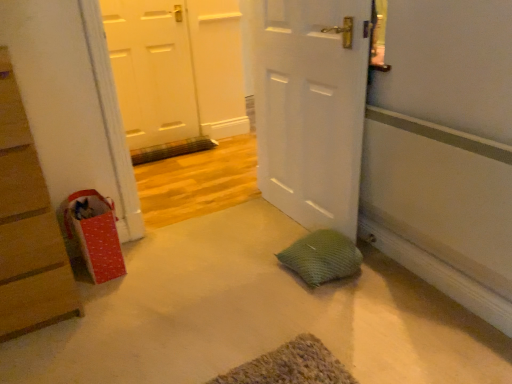
Question: From a real-world perspective, is white matte door at upper left, the first door from the left, physically above green mesh pillow at center?

Choices:
 (A) no
 (B) yes

Answer: (B)

Question: Can you confirm if white matte door at upper left, which is counted as the second door, starting from the right, is taller than green mesh pillow at center?

Choices:
 (A) no
 (B) yes

Answer: (B)

Question: Are white matte door at upper left, acting as the first door starting from the back, and green mesh pillow at center making contact?

Choices:
 (A) no
 (B) yes

Answer: (A)

Question: Can you confirm if white matte door at upper left, the second door viewed from the front, is thinner than green mesh pillow at center?

Choices:
 (A) no
 (B) yes

Answer: (B)

Question: Could you tell me if white matte door at upper left, the first door from the left, is turned towards green mesh pillow at center?

Choices:
 (A) no
 (B) yes

Answer: (B)

Question: From the image's perspective, is white matte door at center, which ranks as the 1th door in right-to-left order, positioned above or below red cardboard chest of drawers at left?

Choices:
 (A) below
 (B) above

Answer: (B)

Question: Is white matte door at center, which appears as the 2th door when viewed from the left, taller or shorter than red cardboard chest of drawers at left?

Choices:
 (A) tall
 (B) short

Answer: (A)

Question: Considering the positions of point (345, 92) and point (0, 172), is point (345, 92) closer or farther from the camera than point (0, 172)?

Choices:
 (A) farther
 (B) closer

Answer: (A)

Question: Relative to red cardboard chest of drawers at left, is white matte door at center, which appears as the 2th door when viewed from the left, in front or behind?

Choices:
 (A) front
 (B) behind

Answer: (B)

Question: From a real-world perspective, is red dotted paper bag at left above or below white matte door at center, the first door in the front-to-back sequence?

Choices:
 (A) below
 (B) above

Answer: (A)

Question: In the image, is red dotted paper bag at left positioned in front of or behind white matte door at center, which appears as the 2th door when viewed from the back?

Choices:
 (A) front
 (B) behind

Answer: (B)

Question: In terms of size, does red dotted paper bag at left appear bigger or smaller than white matte door at center, which appears as the 2th door when viewed from the left?

Choices:
 (A) small
 (B) big

Answer: (A)

Question: In terms of height, does red dotted paper bag at left look taller or shorter compared to white matte door at center, the first door in the front-to-back sequence?

Choices:
 (A) short
 (B) tall

Answer: (A)

Question: In terms of width, does red cardboard chest of drawers at left look wider or thinner when compared to red dotted paper bag at left?

Choices:
 (A) wide
 (B) thin

Answer: (A)

Question: Looking at the image, does red cardboard chest of drawers at left seem bigger or smaller compared to red dotted paper bag at left?

Choices:
 (A) big
 (B) small

Answer: (A)